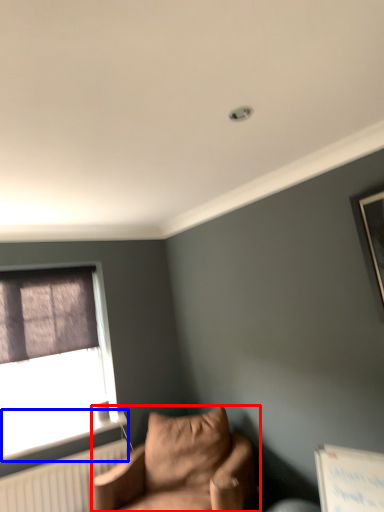
Question: Which of the following is the farthest to the observer, studio couch (highlighted by a red box) or window sill (highlighted by a blue box)?

Choices:
 (A) studio couch
 (B) window sill

Answer: (B)